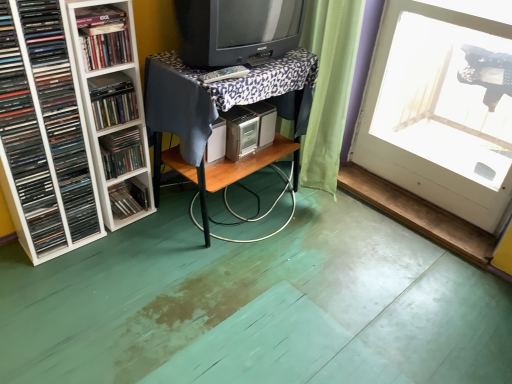
This screenshot has height=384, width=512. In order to click on vacant point to the right of matte black cd case at lower left, the 5th book from the top in this screenshot , I will do `click(158, 215)`.